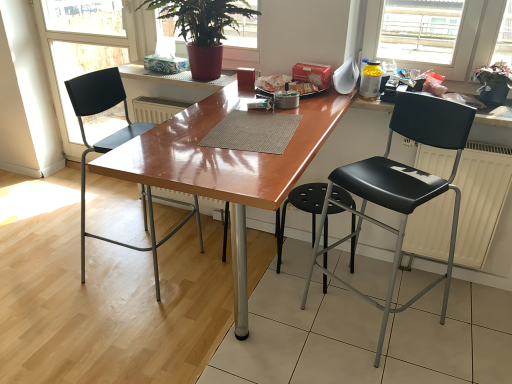
Identify the location of vacant space to the left of black plastic stool at center. (262, 286).